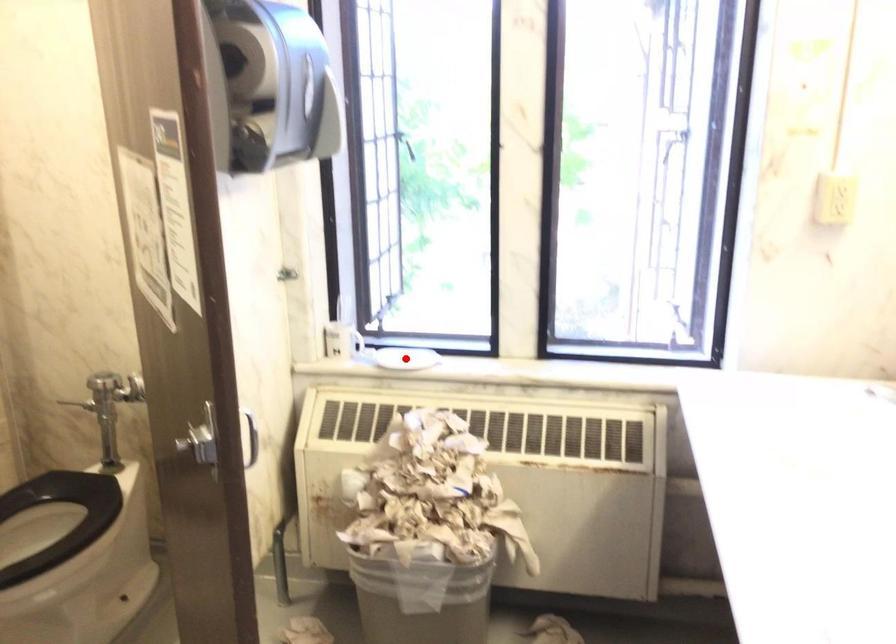
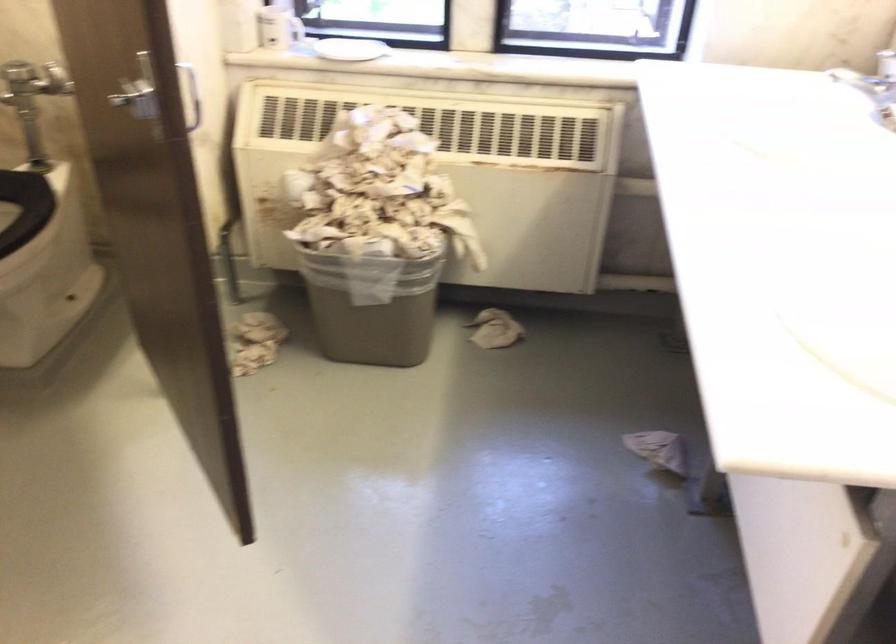
Find the pixel in the second image that matches the highlighted location in the first image.

(349, 49)